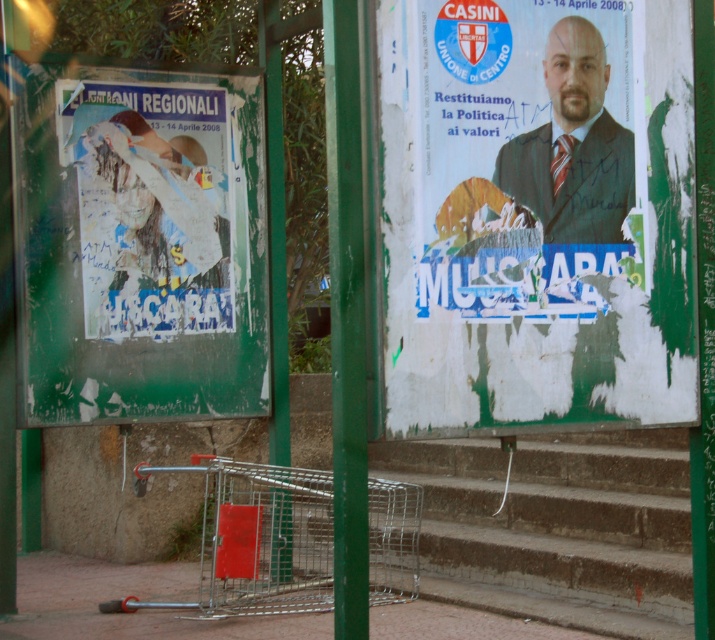
You are a graphic designer evaluating the bus stop posters. Which object, the white paper poster at left or the matte black suit at upper center, has a larger size?

The white paper poster at left is bigger than the matte black suit at upper center.